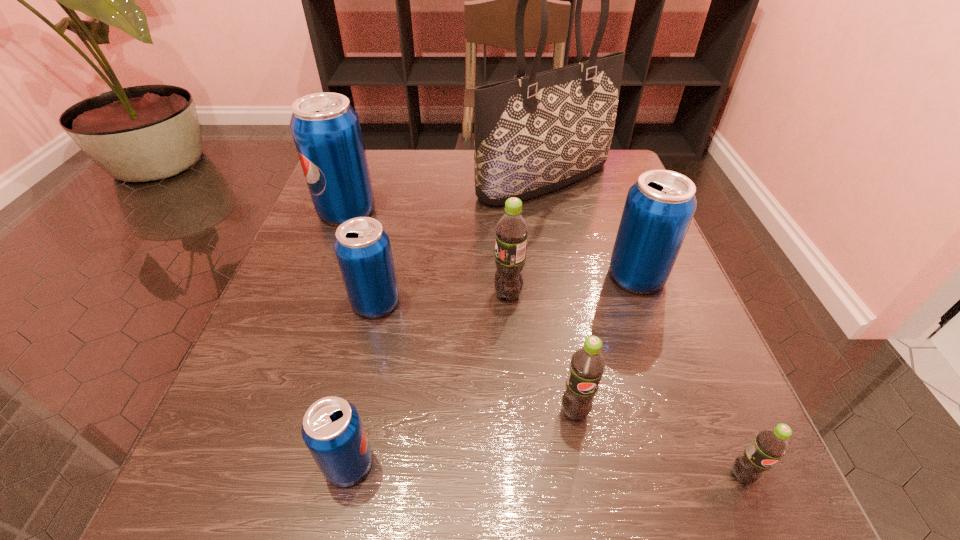
Locate an element on the screen. The image size is (960, 540). blank space located on the front label of the sixth farthest object is located at coordinates (590, 505).

Image resolution: width=960 pixels, height=540 pixels. Identify the location of free space located on the back of the smallest blue pop soda. (381, 314).

You are a GUI agent. You are given a task and a screenshot of the screen. Output one action in this format:
    pyautogui.click(x=<x>, y=<y>)
    Task: Click on the tote bag present at the far edge
    This screenshot has height=540, width=960.
    Given the screenshot: What is the action you would take?
    pyautogui.click(x=534, y=134)

Identify the location of pop soda located in the far edge section of the desktop. This screenshot has width=960, height=540. (326, 130).

This screenshot has width=960, height=540. In order to click on tote bag that is at the right edge in this screenshot , I will do `click(534, 134)`.

I want to click on object positioned at the far left corner, so click(326, 130).

I want to click on object at the near left corner, so 332,430.

You are a GUI agent. You are given a task and a screenshot of the screen. Output one action in this format:
    pyautogui.click(x=<x>, y=<y>)
    Task: Click on the object situated at the far right corner
    
    Given the screenshot: What is the action you would take?
    pyautogui.click(x=534, y=134)

Identify the location of object at the near right corner. The width and height of the screenshot is (960, 540). (769, 445).

This screenshot has width=960, height=540. In the image, there is a desktop. Find the location of `vacant space at the far edge`. vacant space at the far edge is located at coordinates (416, 188).